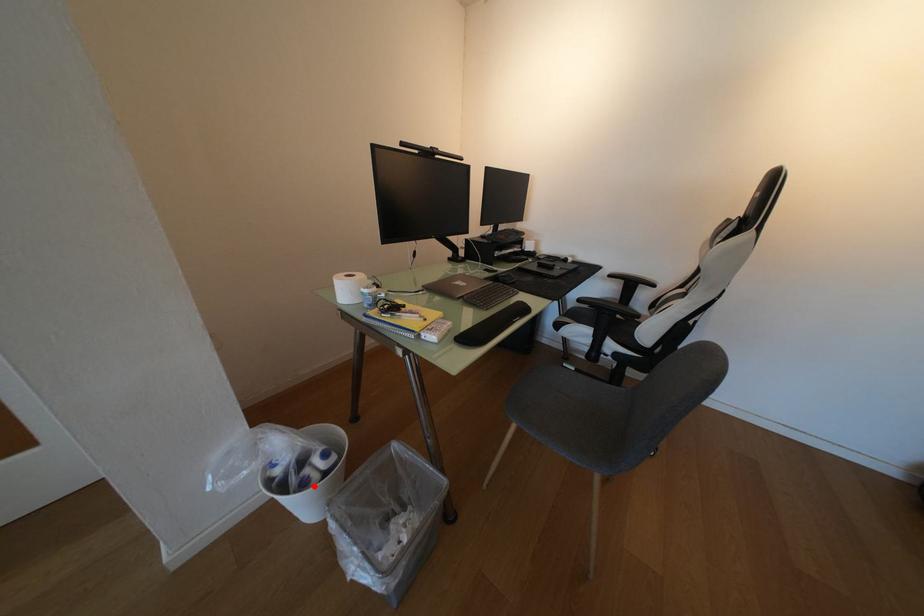
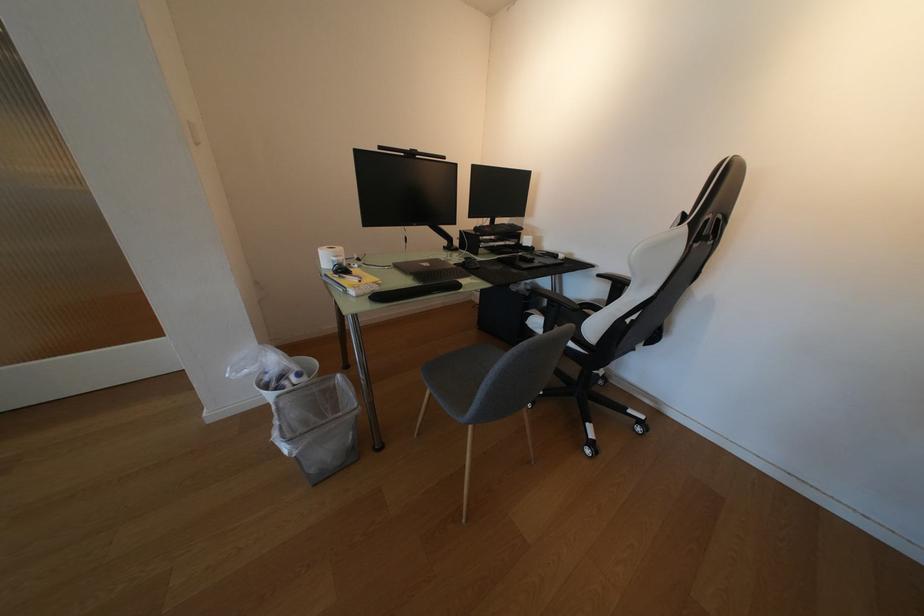
Question: I am providing you with two images of the same scene from different viewpoints. Given a red point in image1, look at the same physical point in image2. Is it:

Choices:
 (A) Closer to the viewpoint
 (B) Farther from the viewpoint

Answer: (B)